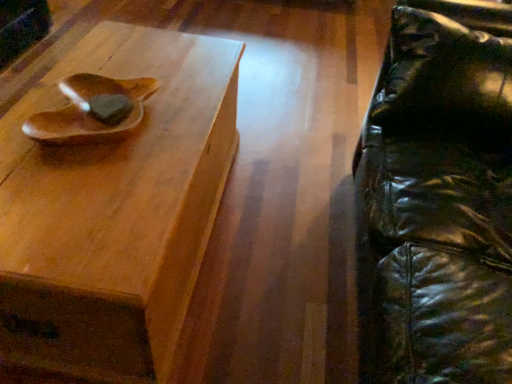
In order to face wooden bowl at upper left, should I rotate leftwards or rightwards?

You should rotate left by 20.447 degrees.

This screenshot has height=384, width=512. What do you see at coordinates (438, 199) in the screenshot? I see `black leather swivel chair at right` at bounding box center [438, 199].

Image resolution: width=512 pixels, height=384 pixels. What are the coordinates of `wooden tray at upper left` in the screenshot? It's located at (115, 209).

This screenshot has width=512, height=384. Find the location of `wooden bowl at upper left`. wooden bowl at upper left is located at coordinates (88, 109).

Which of these two, black leather swivel chair at right or wooden tray at upper left, is wider?

Wider between the two is black leather swivel chair at right.

Which is correct: black leather swivel chair at right is inside wooden tray at upper left, or outside of it?

black leather swivel chair at right is not enclosed by wooden tray at upper left.

From the image's perspective, would you say black leather swivel chair at right is shown under wooden tray at upper left?

Yes.

From a real-world perspective, who is located higher, black leather swivel chair at right or wooden tray at upper left?

In real-world perspective, black leather swivel chair at right is above.

In the image, is wooden bowl at upper left on the left side or the right side of wooden tray at upper left?

From the image, it's evident that wooden bowl at upper left is to the left of wooden tray at upper left.

From the image's perspective, is wooden bowl at upper left on top of wooden tray at upper left?

Yes, from the image's perspective, wooden bowl at upper left is on top of wooden tray at upper left.

Considering the points (81, 120) and (162, 79), which point is behind, point (81, 120) or point (162, 79)?

Positioned behind is point (162, 79).

Does wooden bowl at upper left turn towards wooden tray at upper left?

No.

Which is in front, point (135, 276) or point (130, 124)?

The point (135, 276) is closer.

From a real-world perspective, which object rests below the other?

In real-world perspective, wooden tray at upper left is lower.

In the scene shown: Can you confirm if wooden tray at upper left is positioned to the right of wooden bowl at upper left?

Yes.

Is wooden tray at upper left touching wooden bowl at upper left?

wooden tray at upper left and wooden bowl at upper left are clearly separated.

Which is less distant, (113, 91) or (384, 190)?

The point (384, 190) is closer.

From a real-world perspective, which object stands above the other?

wooden bowl at upper left is physically above.

From the image's perspective, is wooden bowl at upper left on black leather swivel chair at right?

Yes.

Is wooden bowl at upper left completely or partially outside of black leather swivel chair at right?

Yes, wooden bowl at upper left is located beyond the bounds of black leather swivel chair at right.

How far apart are black leather swivel chair at right and wooden bowl at upper left?

32.29 inches.

In the scene shown: Does black leather swivel chair at right turn towards wooden bowl at upper left?

Yes, black leather swivel chair at right is turned towards wooden bowl at upper left.

Who is shorter, black leather swivel chair at right or wooden bowl at upper left?

wooden bowl at upper left is shorter.

Locate an element on the screen. swivel chair located in front of the wooden bowl at upper left is located at coordinates (438, 199).

Considering the relative sizes of wooden tray at upper left and black leather swivel chair at right in the image provided, is wooden tray at upper left taller than black leather swivel chair at right?

No, wooden tray at upper left is not taller than black leather swivel chair at right.

From a real-world perspective, is wooden tray at upper left physically located above or below black leather swivel chair at right?

In terms of real-world spatial position, wooden tray at upper left is below black leather swivel chair at right.

Looking at this image, considering the sizes of objects wooden tray at upper left and black leather swivel chair at right in the image provided, who is thinner, wooden tray at upper left or black leather swivel chair at right?

wooden tray at upper left is thinner.

From the image's perspective, who appears lower, wooden tray at upper left or black leather swivel chair at right?

black leather swivel chair at right appears lower in the image.

The height and width of the screenshot is (384, 512). Identify the location of table above the black leather swivel chair at right (from the image's perspective). (115, 209).

Locate an element on the screen. This screenshot has width=512, height=384. footwear on the left of wooden tray at upper left is located at coordinates (88, 109).

From the image, which object appears to be nearer to wooden tray at upper left, wooden bowl at upper left or black leather swivel chair at right?

Based on the image, wooden bowl at upper left appears to be nearer to wooden tray at upper left.

Estimate the real-world distances between objects in this image. Which object is closer to black leather swivel chair at right, wooden bowl at upper left or wooden tray at upper left?

wooden tray at upper left.

Based on the photo, based on their spatial positions, is wooden tray at upper left or black leather swivel chair at right further from wooden bowl at upper left?

black leather swivel chair at right.

Looking at the image, which one is located closer to wooden tray at upper left, black leather swivel chair at right or wooden bowl at upper left?

Among the two, wooden bowl at upper left is located nearer to wooden tray at upper left.

Based on their spatial positions, is wooden tray at upper left or wooden bowl at upper left closer to black leather swivel chair at right?

wooden tray at upper left lies closer to black leather swivel chair at right than the other object.

Looking at the image, which one is located closer to wooden bowl at upper left, black leather swivel chair at right or wooden tray at upper left?

wooden tray at upper left is positioned closer to the anchor wooden bowl at upper left.

I want to click on table situated between wooden bowl at upper left and black leather swivel chair at right from left to right, so click(x=115, y=209).